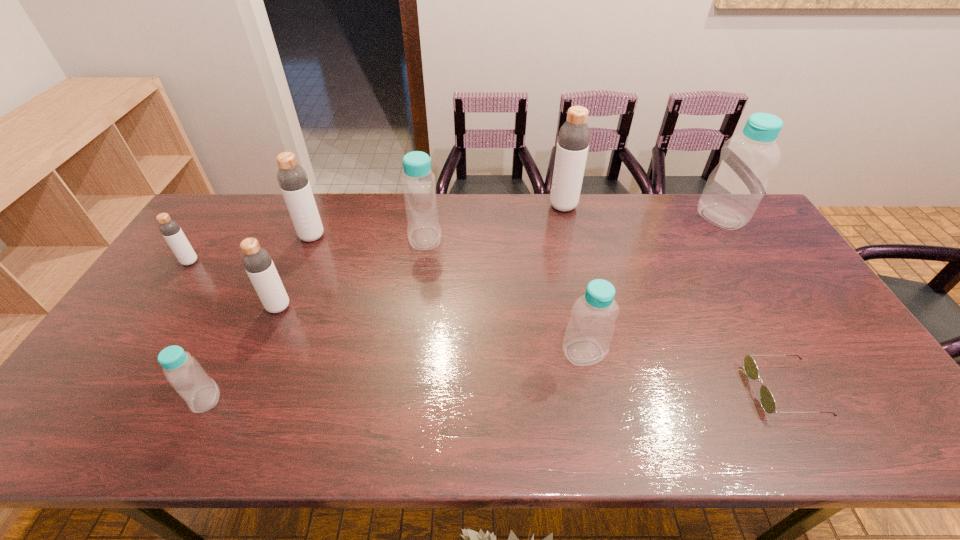
At what (x,y) coordinates should I click in order to perform the action: click on unoccupied area between the shortest object and the nearest bottle. Please return your answer as a coordinate pair (x, y). This screenshot has width=960, height=540. Looking at the image, I should click on (495, 394).

Image resolution: width=960 pixels, height=540 pixels. Find the location of `vacant area that lies between the leftmost blue bottle and the rightmost blue bottle`. vacant area that lies between the leftmost blue bottle and the rightmost blue bottle is located at coordinates (464, 308).

This screenshot has height=540, width=960. I want to click on free space between the fifth nearest object and the biggest blue bottle, so click(x=456, y=239).

The width and height of the screenshot is (960, 540). In order to click on vacant space in between the fifth object from left to right and the third farthest gray bottle in this screenshot , I will do `click(307, 250)`.

At what (x,y) coordinates should I click in order to perform the action: click on free space between the smallest blue bottle and the nearest gray bottle. Please return your answer as a coordinate pair (x, y). The height and width of the screenshot is (540, 960). Looking at the image, I should click on (242, 353).

You are a GUI agent. You are given a task and a screenshot of the screen. Output one action in this format:
    pyautogui.click(x=<x>, y=<y>)
    Task: Click on the free spot between the third smallest gray bottle and the second bottle from left to right
    The height and width of the screenshot is (540, 960).
    Given the screenshot: What is the action you would take?
    pyautogui.click(x=259, y=318)

In order to click on free space that is in between the rightmost bottle and the second smallest gray bottle in this screenshot , I will do `click(500, 262)`.

Where is `vacant area that lies between the third blue bottle from right to left and the rightmost blue bottle`? Image resolution: width=960 pixels, height=540 pixels. vacant area that lies between the third blue bottle from right to left and the rightmost blue bottle is located at coordinates (573, 228).

You are a GUI agent. You are given a task and a screenshot of the screen. Output one action in this format:
    pyautogui.click(x=<x>, y=<y>)
    Task: Click on the object that stands as the seventh closest to the fifth farthest object
    
    Given the screenshot: What is the action you would take?
    pyautogui.click(x=767, y=401)

Locate an element on the screen. Image resolution: width=960 pixels, height=540 pixels. object identified as the fifth closest to the rightmost blue bottle is located at coordinates (292, 178).